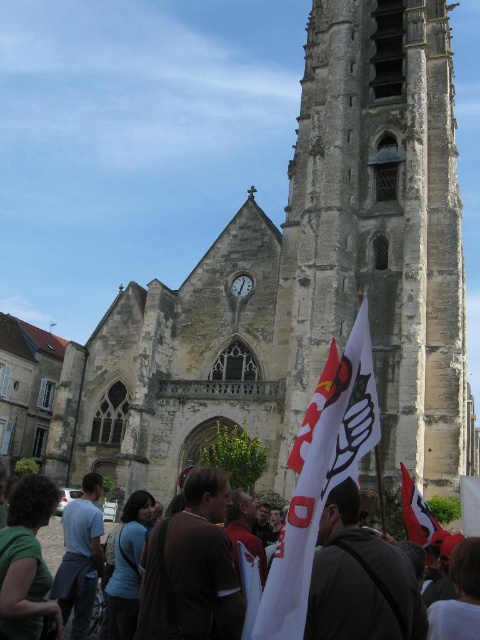
You are a photographer trying to capture a photo of the crowd in front of the historic stone church. You notice two people wearing a brown leather jacket at center and a green matte shirt at lower left. Which clothing item would appear bigger in your photo?

The brown leather jacket at center would appear bigger in the photo because it is larger in size than the green matte shirt at lower left.

In the scene shown: You are a photographer standing in front of the historic stone church. You notice the white cotton flags at lower center and the brown fabric shirt at lower right. Which object would appear larger in your photo?

The white cotton flags at lower center would appear larger in the photo since they are bigger than the brown fabric shirt at lower right.

You are a photographer standing at the front of the church. You want to take a photo of the crowd while ensuring both the green matte shirt at lower left and the white cotton flags at lower center are visible. Which object should you adjust your camera angle to focus on first to ensure both are in frame?

The green matte shirt at lower left is shorter than the white cotton flags at lower center, so you should focus on the white cotton flags at lower center first to ensure the shorter green matte shirt at lower left is also captured in the frame.